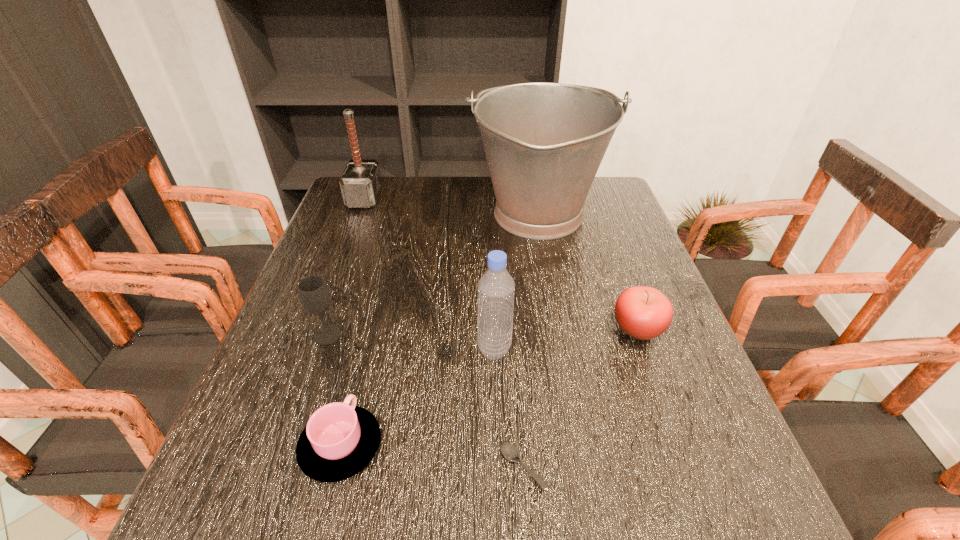
Find the location of `hammer that is positioned at the left edge`. hammer that is positioned at the left edge is located at coordinates (361, 183).

Where is `wineglass situated at the left edge`? The image size is (960, 540). wineglass situated at the left edge is located at coordinates (313, 292).

At what (x,y) coordinates should I click in order to perform the action: click on cup located in the left edge section of the desktop. Please return your answer as a coordinate pair (x, y). The image size is (960, 540). Looking at the image, I should click on (339, 440).

You are a GUI agent. You are given a task and a screenshot of the screen. Output one action in this format:
    pyautogui.click(x=<x>, y=<y>)
    Task: Click on the bucket that is at the right edge
    The height and width of the screenshot is (540, 960).
    Given the screenshot: What is the action you would take?
    pyautogui.click(x=544, y=142)

You are a GUI agent. You are given a task and a screenshot of the screen. Output one action in this format:
    pyautogui.click(x=<x>, y=<y>)
    Task: Click on the apple present at the right edge
    
    Given the screenshot: What is the action you would take?
    pyautogui.click(x=644, y=313)

Where is `object situated at the far left corner`? object situated at the far left corner is located at coordinates click(x=361, y=183).

Where is `object that is at the near left corner`? This screenshot has width=960, height=540. object that is at the near left corner is located at coordinates (339, 440).

In order to click on object that is at the far right corner in this screenshot , I will do `click(544, 142)`.

What are the coordinates of `free space at the far edge of the desktop` in the screenshot? It's located at (428, 211).

This screenshot has height=540, width=960. I want to click on vacant space at the near edge of the desktop, so click(630, 500).